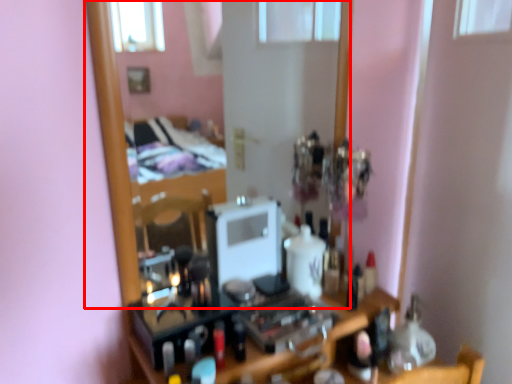
Question: From the image's perspective, where is mirror (annotated by the red box) located in relation to toiletry in the image?

Choices:
 (A) above
 (B) below

Answer: (A)